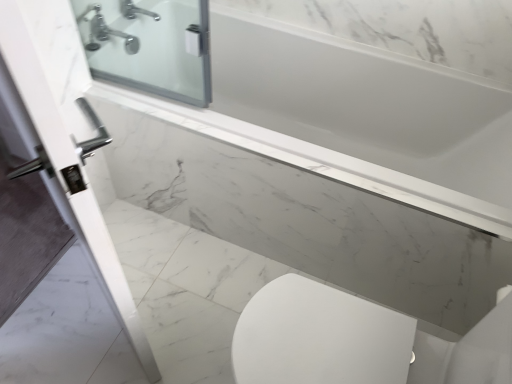
Where is `vacant region to the left of white glossy door handle at left`? Image resolution: width=512 pixels, height=384 pixels. vacant region to the left of white glossy door handle at left is located at coordinates (51, 312).